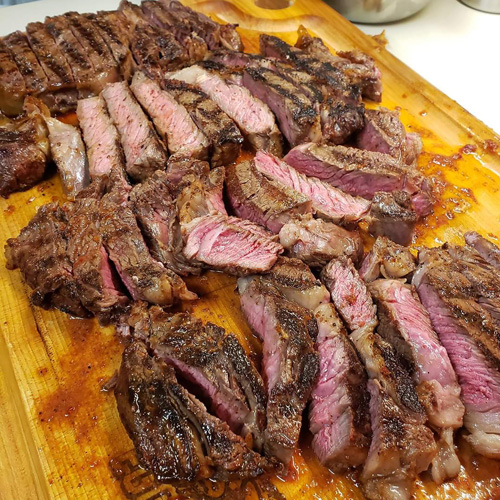
This screenshot has width=500, height=500. Identify the location of desk. (473, 60).